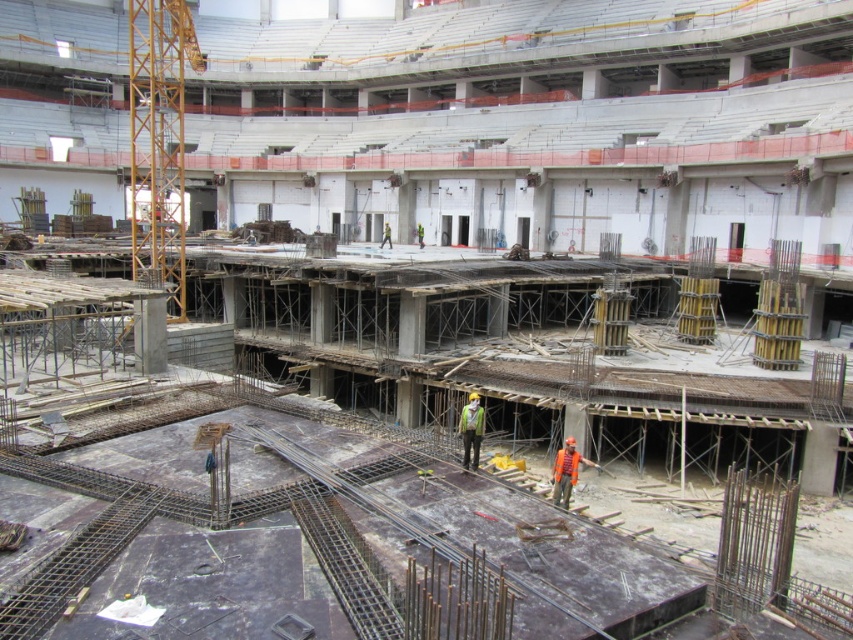
Question: Can you confirm if yellow metallic crane at left is thinner than orange reflective vest at center?

Choices:
 (A) yes
 (B) no

Answer: (B)

Question: Among these points, which one is farthest from the camera?

Choices:
 (A) (474, 426)
 (B) (173, 81)

Answer: (B)

Question: Which point is farther from the camera taking this photo?

Choices:
 (A) (575, 468)
 (B) (469, 401)
 (C) (158, 141)

Answer: (C)

Question: Is orange reflective vest at center thinner than green reflective safety vest at center?

Choices:
 (A) no
 (B) yes

Answer: (A)

Question: Which point is closer to the camera taking this photo?

Choices:
 (A) (190, 44)
 (B) (564, 452)
 (C) (468, 404)

Answer: (B)

Question: Can you confirm if yellow metallic crane at left is positioned to the right of green reflective safety vest at center?

Choices:
 (A) yes
 (B) no

Answer: (B)